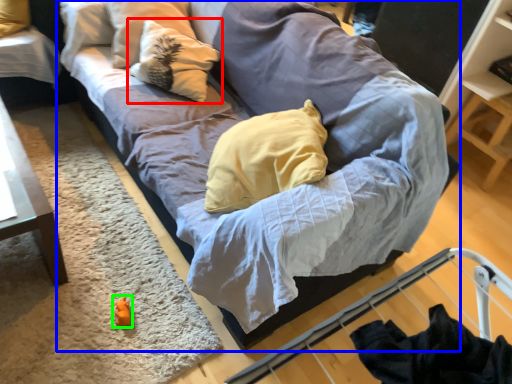
Question: Which is nearer to the pillow (highlighted by a red box)? studio couch (highlighted by a blue box) or toy (highlighted by a green box).

Choices:
 (A) studio couch
 (B) toy

Answer: (A)